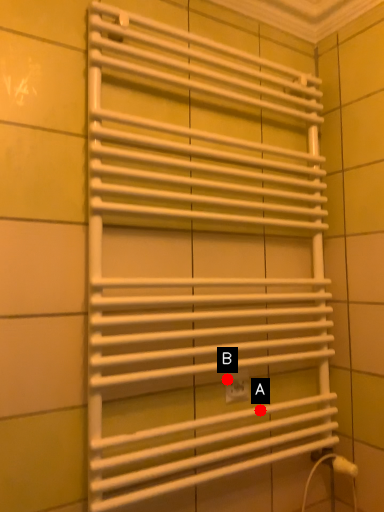
Question: Two points are circled on the image, labeled by A and B beside each circle. Among these points, which one is nearest to the camera?

Choices:
 (A) A is closer
 (B) B is closer

Answer: (B)